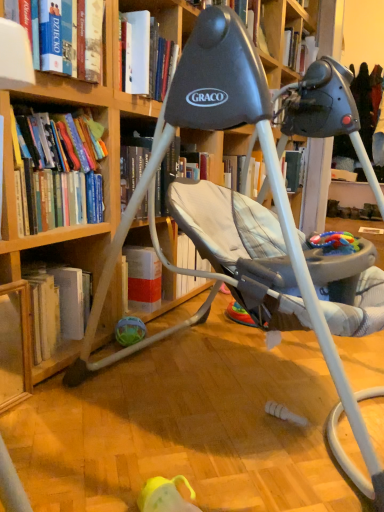
Question: Is hardcover books at left, the 1th book in the bottom-to-top sequence, facing towards wooden bookcase at center?

Choices:
 (A) no
 (B) yes

Answer: (B)

Question: Is hardcover books at left, arranged as the second book when viewed from the top, at the right side of wooden bookcase at center?

Choices:
 (A) yes
 (B) no

Answer: (B)

Question: From a real-world perspective, is hardcover books at left, arranged as the second book when viewed from the top, under wooden bookcase at center?

Choices:
 (A) no
 (B) yes

Answer: (A)

Question: Is hardcover books at left, arranged as the second book when viewed from the top, positioned before wooden bookcase at center?

Choices:
 (A) no
 (B) yes

Answer: (A)

Question: Can you confirm if hardcover books at left, arranged as the second book when viewed from the top, is thinner than wooden bookcase at center?

Choices:
 (A) yes
 (B) no

Answer: (A)

Question: Looking at their shapes, would you say multicolored plastic toy at center, which is counted as the 2th toy, starting from the left, is wider or thinner than wooden bookshelf at lower left, which appears as the 2th shelf when viewed from the back?

Choices:
 (A) wide
 (B) thin

Answer: (A)

Question: Choose the correct answer: Is multicolored plastic toy at center, the 1th toy positioned from the front, inside wooden bookshelf at lower left, the first shelf from the front, or outside it?

Choices:
 (A) outside
 (B) inside

Answer: (A)

Question: From the image's perspective, is multicolored plastic toy at center, which is counted as the 2th toy, starting from the left, located above or below wooden bookshelf at lower left, which appears as the 2th shelf when viewed from the back?

Choices:
 (A) below
 (B) above

Answer: (B)

Question: Does point (342, 238) appear closer or farther from the camera than point (18, 369)?

Choices:
 (A) farther
 (B) closer

Answer: (B)

Question: Is wooden bookshelf at lower left, which appears as the 2th shelf when viewed from the back, inside or outside of translucent plastic ball at lower center, which ranks as the second toy in right-to-left order?

Choices:
 (A) inside
 (B) outside

Answer: (B)

Question: From a real-world perspective, is wooden bookshelf at lower left, which appears as the 2th shelf when viewed from the back, above or below translucent plastic ball at lower center, marked as the 2th toy in a front-to-back arrangement?

Choices:
 (A) above
 (B) below

Answer: (A)

Question: Relative to translucent plastic ball at lower center, the 1th toy positioned from the left, is wooden bookshelf at lower left, which appears as the 2th shelf when viewed from the back, in front or behind?

Choices:
 (A) front
 (B) behind

Answer: (A)

Question: From the image's perspective, is wooden bookshelf at lower left, which appears as the 2th shelf when viewed from the back, positioned above or below translucent plastic ball at lower center, which is counted as the first toy, starting from the bottom?

Choices:
 (A) below
 (B) above

Answer: (B)

Question: Is hardcover books at left, arranged as the second book when viewed from the top, to the left or to the right of translucent plastic ball at lower center, marked as the 2th toy in a front-to-back arrangement, in the image?

Choices:
 (A) right
 (B) left

Answer: (B)

Question: From a real-world perspective, is hardcover books at left, the 1th book in the bottom-to-top sequence, physically located above or below translucent plastic ball at lower center, marked as the 2th toy in a front-to-back arrangement?

Choices:
 (A) below
 (B) above

Answer: (B)